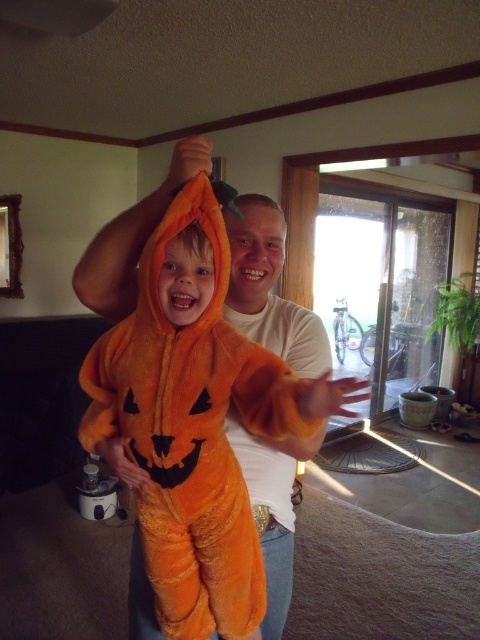
Question: Which point is farther to the camera?

Choices:
 (A) [x=264, y=204]
 (B) [x=292, y=374]

Answer: (A)

Question: Estimate the real-world distances between objects in this image. Which object is farther from the matte orange pumpkin at center?

Choices:
 (A) white cotton shirt at center
 (B) velvety orange pumpkin at center

Answer: (B)

Question: Can you confirm if velvety orange pumpkin at center is bigger than white cotton shirt at center?

Choices:
 (A) no
 (B) yes

Answer: (A)

Question: Which object is positioned farthest from the matte orange pumpkin at center?

Choices:
 (A) velvety orange pumpkin at center
 (B) white cotton shirt at center

Answer: (A)

Question: Can you confirm if white cotton shirt at center is positioned below matte orange pumpkin at center?

Choices:
 (A) no
 (B) yes

Answer: (B)

Question: Can you confirm if velvety orange pumpkin at center is bigger than white cotton shirt at center?

Choices:
 (A) yes
 (B) no

Answer: (B)